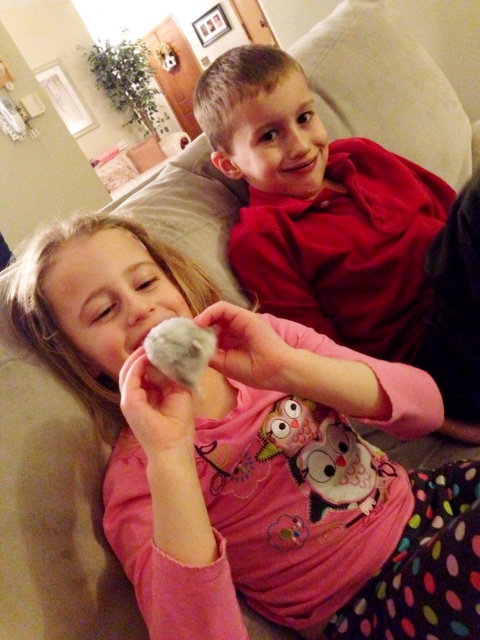
You are a toy store employee who needs to place the fluffy pink owl at center and the matte red shirt at upper right on a shelf. The shelf has a maximum width of 15 inches. Can both items fit side by side on the shelf without overlapping?

The distance between the fluffy pink owl at center and the matte red shirt at upper right is 16.37 inches, which exceeds the shelf width of 15 inches. Therefore, they cannot fit side by side without overlapping.

You are a photographer standing in front of the two children on the couch. You want to take a photo of the point at coordinates point (196, 637) and point (277, 96). Which point is closer to you?

Point (196, 637) is in front of point (277, 96), so the point at coordinates point (196, 637) is closer to you.